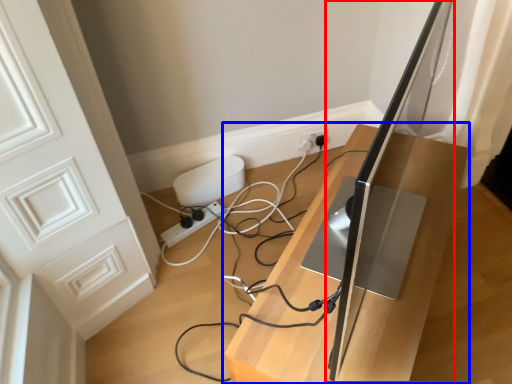
Question: Which point is closer to the camera, computer monitor (highlighted by a red box) or furniture (highlighted by a blue box)?

Choices:
 (A) computer monitor
 (B) furniture

Answer: (A)